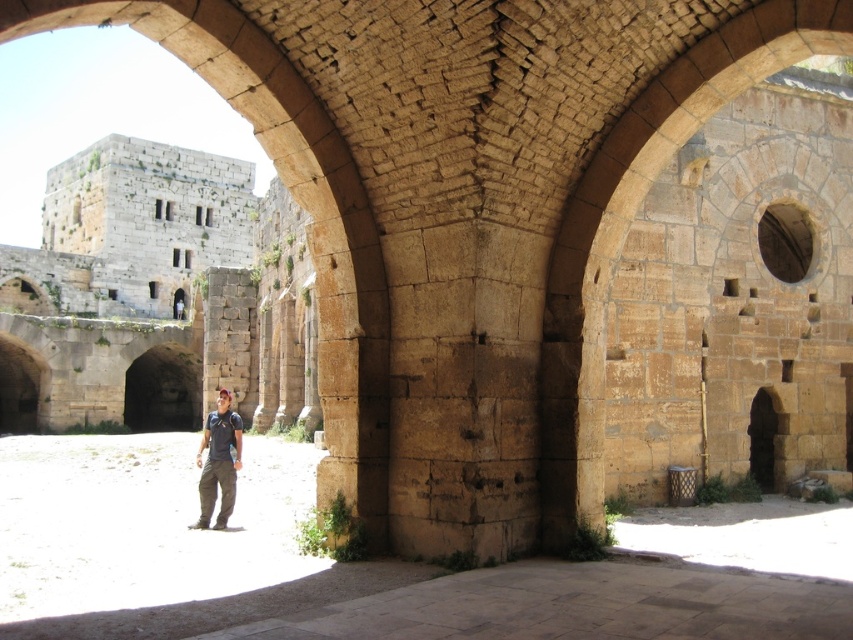
Question: Can you confirm if brown stone courtyard at center is wider than dark blue t-shirt at center?

Choices:
 (A) yes
 (B) no

Answer: (A)

Question: From the image, what is the correct spatial relationship of brown stone archway at center in relation to dark blue t-shirt at center?

Choices:
 (A) left
 (B) right

Answer: (B)

Question: Can you confirm if brown stone courtyard at center is wider than brown stone archway at center?

Choices:
 (A) no
 (B) yes

Answer: (B)

Question: Which object is the farthest from the brown stone courtyard at center?

Choices:
 (A) brown stone archway at center
 (B) dark blue t-shirt at center

Answer: (A)

Question: Among these points, which one is nearest to the camera?

Choices:
 (A) (564, 433)
 (B) (222, 428)

Answer: (A)

Question: Which point appears farthest from the camera in this image?

Choices:
 (A) (212, 512)
 (B) (656, 604)

Answer: (A)